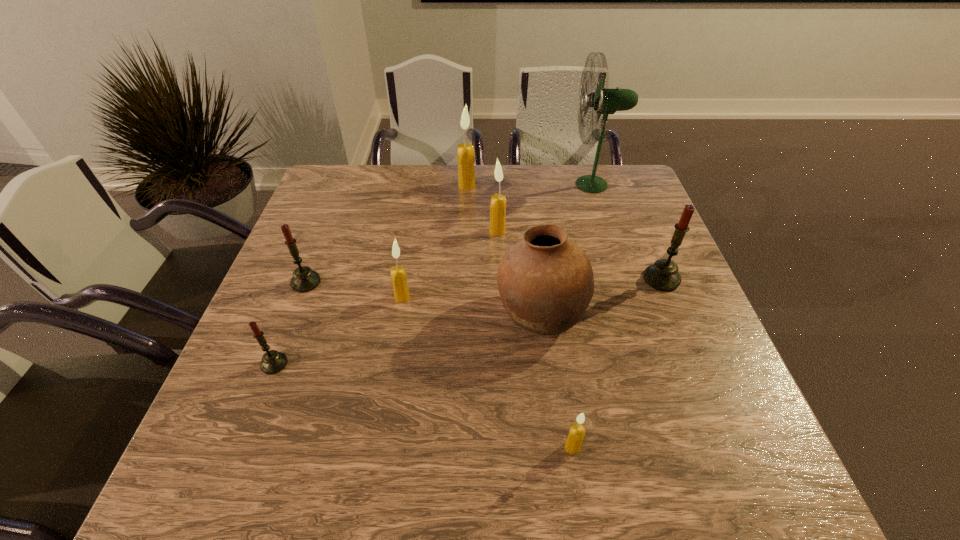
Find the location of `free spot between the seventh nearest object and the second cream candle from left to right`. free spot between the seventh nearest object and the second cream candle from left to right is located at coordinates click(x=482, y=208).

I want to click on free space between the second smallest cream candle and the tallest object, so click(497, 241).

The width and height of the screenshot is (960, 540). I want to click on free space between the second biggest red candle and the smallest red candle, so click(x=290, y=323).

At what (x,y) coordinates should I click in order to perform the action: click on vacant space that is in between the third cream candle from left to right and the second biggest red candle. Please return your answer as a coordinate pair (x, y). Looking at the image, I should click on (401, 256).

Locate an element on the screen. This screenshot has height=540, width=960. free spot between the smallest red candle and the tallest object is located at coordinates (434, 274).

Where is `free point between the smallest red candle and the third smallest cream candle`? The image size is (960, 540). free point between the smallest red candle and the third smallest cream candle is located at coordinates (386, 298).

What are the coordinates of `blank region between the second nearest object and the rightmost candle` in the screenshot? It's located at (468, 321).

Locate an element on the screen. vacant area between the smallest red candle and the second farthest candle is located at coordinates (386, 298).

In order to click on object that is the second closest to the second biggest red candle in this screenshot , I will do `click(398, 275)`.

Identify which object is the second closest to the second smallest red candle. Please provide its 2D coordinates. Your answer should be formatted as a tuple, i.e. [(x, y)], where the tuple contains the x and y coordinates of a point satisfying the conditions above.

[(398, 275)]